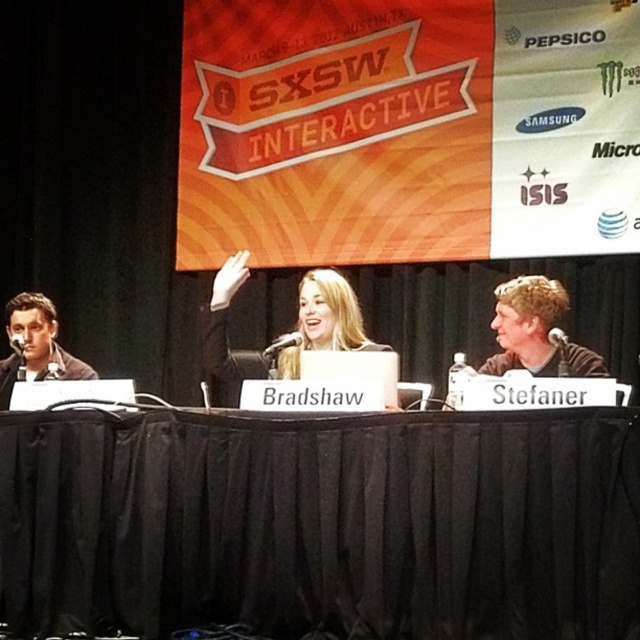
Question: Does black fabric table at center have a larger size compared to light brown hair at right?

Choices:
 (A) yes
 (B) no

Answer: (A)

Question: Is blonde hair at center bigger than matte black jacket at left?

Choices:
 (A) no
 (B) yes

Answer: (B)

Question: Which object is positioned farthest from the black fabric table at center?

Choices:
 (A) light brown hair at right
 (B) blonde hair at center

Answer: (A)

Question: Observing the image, what is the correct spatial positioning of light brown hair at right in reference to matte black jacket at left?

Choices:
 (A) left
 (B) right

Answer: (B)

Question: Among these points, which one is farthest from the camera?

Choices:
 (A) (538, 376)
 (B) (244, 260)

Answer: (B)

Question: Which point is closer to the camera taking this photo?

Choices:
 (A) (342, 323)
 (B) (72, 368)
 (C) (170, 592)

Answer: (C)